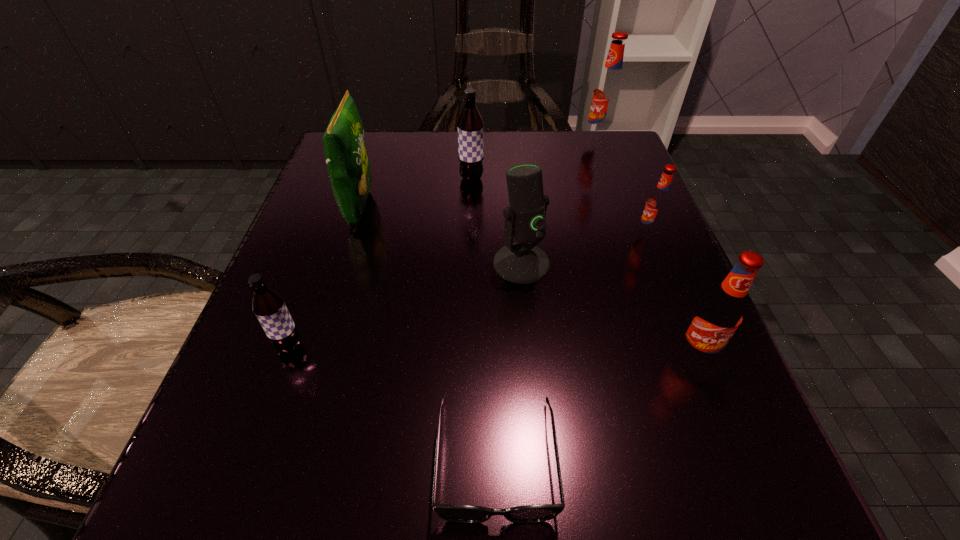
Identify the location of crisp (potato chip) at the far edge. The image size is (960, 540). (348, 165).

Find the location of a particular element. This screenshot has width=960, height=540. object at the near edge is located at coordinates pyautogui.click(x=450, y=512).

Find the location of `crisp (potato chip) that is positioned at the left edge`. crisp (potato chip) that is positioned at the left edge is located at coordinates (348, 165).

Find the location of a particular element. root beer that is positioned at the left edge is located at coordinates (269, 307).

The image size is (960, 540). What are the coordinates of `object that is at the far left corner` in the screenshot? It's located at (348, 165).

Where is `object located at the far right corner`? object located at the far right corner is located at coordinates (608, 92).

This screenshot has width=960, height=540. In the image, there is a desktop. In order to click on vacant space at the far edge in this screenshot , I will do `click(427, 175)`.

Identify the location of blank space at the near edge of the desktop. (422, 532).

Locate an element on the screen. The image size is (960, 540). vacant point at the left edge is located at coordinates (321, 320).

Find the location of a particular element. vacant area at the right edge is located at coordinates (628, 222).